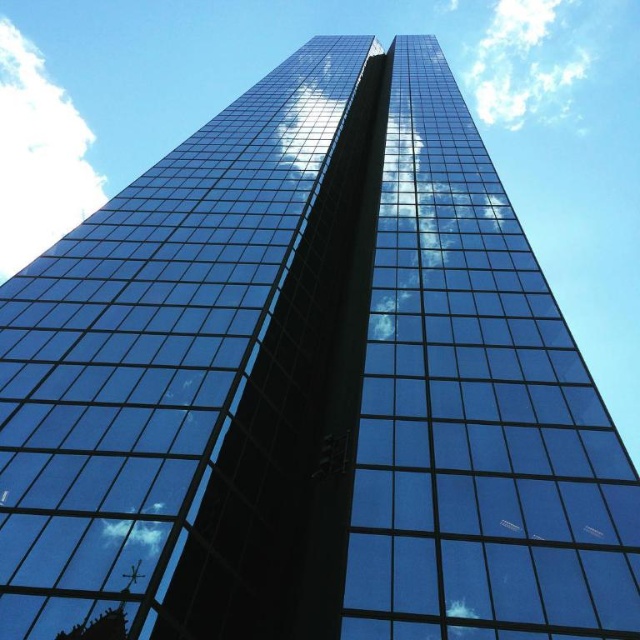
Can you confirm if white fluffy cloud at upper left is positioned above white fluffy cloud at lower left?

Indeed, white fluffy cloud at upper left is positioned over white fluffy cloud at lower left.

Which is above, white fluffy cloud at upper left or white fluffy cloud at lower left?

white fluffy cloud at upper left

Which is behind, point (77, 179) or point (122, 522)?

Point (77, 179)

This screenshot has height=640, width=640. What are the coordinates of `white fluffy cloud at upper left` in the screenshot? It's located at (38, 156).

Is the position of white fluffy cloud at upper left less distant than that of white fluffy cloud at upper center?

No, white fluffy cloud at upper left is further to the viewer.

What do you see at coordinates (38, 156) in the screenshot? I see `white fluffy cloud at upper left` at bounding box center [38, 156].

Identify the location of white fluffy cloud at upper left. (38, 156).

Does white fluffy cloud at upper center have a greater height compared to white fluffy cloud at lower left?

Indeed, white fluffy cloud at upper center has a greater height compared to white fluffy cloud at lower left.

Can you confirm if white fluffy cloud at upper center is positioned to the right of white fluffy cloud at lower left?

Yes, white fluffy cloud at upper center is to the right of white fluffy cloud at lower left.

Who is more distant from viewer, (500, 116) or (163, 538)?

The point (500, 116) is more distant.

The height and width of the screenshot is (640, 640). Identify the location of white fluffy cloud at upper center. (524, 61).